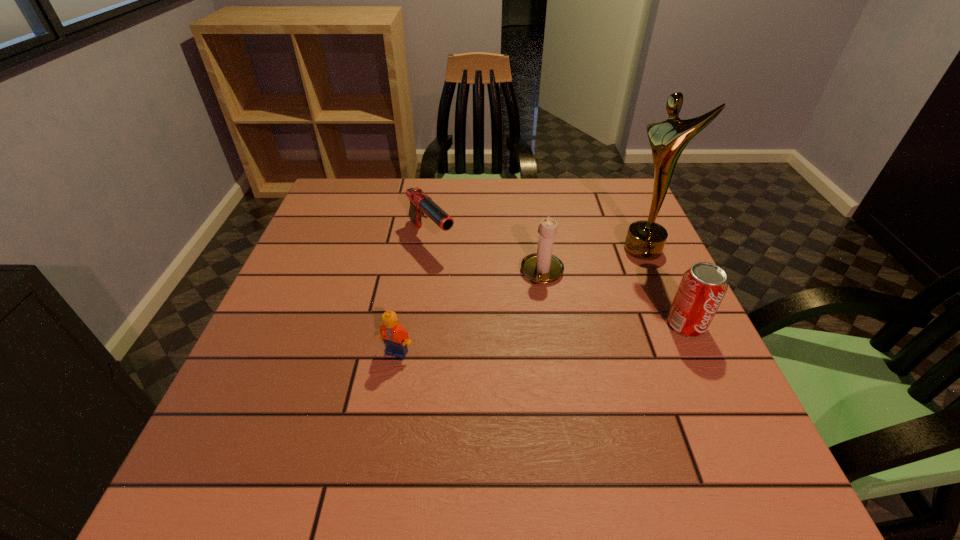
At what (x,y) coordinates should I click in order to perform the action: click on vacant region between the gun and the soda can. Please return your answer as a coordinate pair (x, y). Image resolution: width=960 pixels, height=540 pixels. Looking at the image, I should click on (559, 281).

Find the location of `free space between the nearest object and the award`. free space between the nearest object and the award is located at coordinates (519, 301).

Locate an element on the screen. vacant space that's between the third object from left to right and the award is located at coordinates pos(592,261).

Identify the location of blank region between the gun and the Lego. (414, 295).

Where is `free point between the gun and the candle holder`? The image size is (960, 540). free point between the gun and the candle holder is located at coordinates (487, 255).

Where is `free spot between the Lego and the soda can`? Image resolution: width=960 pixels, height=540 pixels. free spot between the Lego and the soda can is located at coordinates (541, 339).

In order to click on object that stands as the third closest to the fourth farthest object in this screenshot , I will do `click(420, 203)`.

At what (x,y) coordinates should I click in order to perform the action: click on object that is the second closest to the candle holder. Please return your answer as a coordinate pair (x, y). Looking at the image, I should click on click(645, 240).

Locate an element on the screen. vacant region that satisfies the following two spatial constraints: 1. on the front side of the gun; 2. on the left side of the soda can is located at coordinates (420, 325).

Identify the location of free space that satisfies the following two spatial constraints: 1. on the front side of the fourth farthest object; 2. on the left side of the tallest object. This screenshot has height=540, width=960. (675, 325).